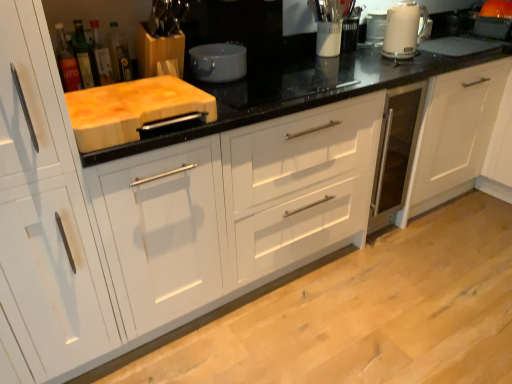
Image resolution: width=512 pixels, height=384 pixels. What are the coordinates of `free location above matte gray pot at center (from a real-world perspective)` in the screenshot? It's located at (215, 43).